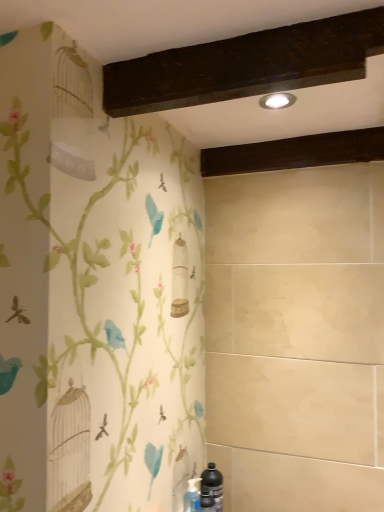
Question: Considering the relative positions of black matte bottle at lower right and matte silver light fixture at upper center in the image provided, is black matte bottle at lower right in front of matte silver light fixture at upper center?

Choices:
 (A) no
 (B) yes

Answer: (A)

Question: Does black matte bottle at lower right have a larger size compared to matte silver light fixture at upper center?

Choices:
 (A) no
 (B) yes

Answer: (B)

Question: Is black matte bottle at lower right aimed at matte silver light fixture at upper center?

Choices:
 (A) yes
 (B) no

Answer: (B)

Question: Is black matte bottle at lower right next to matte silver light fixture at upper center?

Choices:
 (A) yes
 (B) no

Answer: (B)

Question: Is black matte bottle at lower right facing away from matte silver light fixture at upper center?

Choices:
 (A) no
 (B) yes

Answer: (A)

Question: Is black matte bottle at lower right in front of or behind dark wood beam at upper center in the image?

Choices:
 (A) behind
 (B) front

Answer: (B)

Question: Does point (213, 495) appear closer or farther from the camera than point (337, 158)?

Choices:
 (A) closer
 (B) farther

Answer: (B)

Question: Based on their sizes in the image, would you say black matte bottle at lower right is bigger or smaller than dark wood beam at upper center?

Choices:
 (A) small
 (B) big

Answer: (A)

Question: Do you think black matte bottle at lower right is within dark wood beam at upper center, or outside of it?

Choices:
 (A) outside
 (B) inside

Answer: (A)

Question: Is black matte bottle at lower right bigger or smaller than matte silver light fixture at upper center?

Choices:
 (A) big
 (B) small

Answer: (A)

Question: From a real-world perspective, is black matte bottle at lower right positioned above or below matte silver light fixture at upper center?

Choices:
 (A) above
 (B) below

Answer: (B)

Question: In the image, is black matte bottle at lower right positioned in front of or behind matte silver light fixture at upper center?

Choices:
 (A) front
 (B) behind

Answer: (B)

Question: Is black matte bottle at lower right inside or outside of matte silver light fixture at upper center?

Choices:
 (A) outside
 (B) inside

Answer: (A)

Question: From the image's perspective, is matte silver light fixture at upper center located above or below black matte bottle at lower right?

Choices:
 (A) below
 (B) above

Answer: (B)

Question: Looking at the image, does matte silver light fixture at upper center seem bigger or smaller compared to black matte bottle at lower right?

Choices:
 (A) small
 (B) big

Answer: (A)